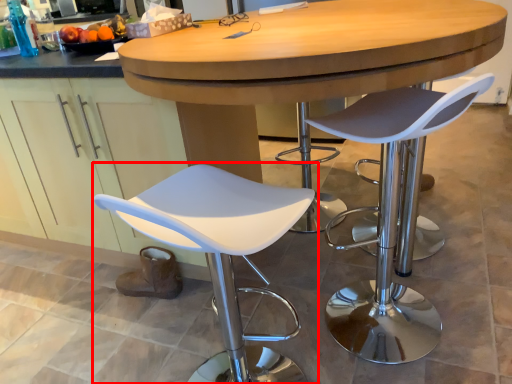
Question: In this image, where is chair (annotated by the red box) located relative to chair?

Choices:
 (A) left
 (B) right

Answer: (A)